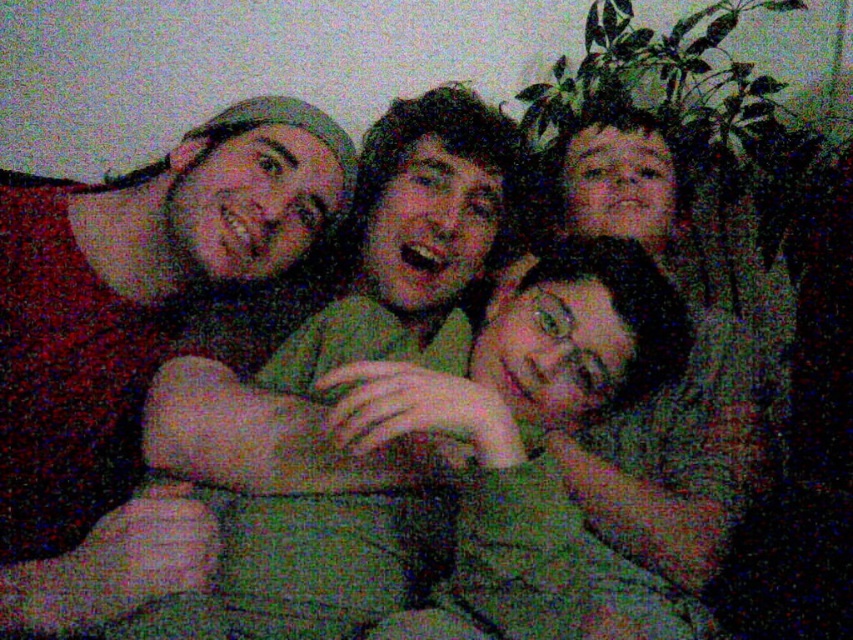
Question: Can you confirm if matte red shirt at left is positioned to the right of green fabric pillow at center?

Choices:
 (A) yes
 (B) no

Answer: (B)

Question: Which point is farther to the camera?

Choices:
 (A) (100, 257)
 (B) (526, 340)

Answer: (A)

Question: Can you confirm if matte red shirt at left is wider than green fabric pillow at center?

Choices:
 (A) no
 (B) yes

Answer: (A)

Question: Does matte red shirt at left have a greater width compared to green fabric pillow at center?

Choices:
 (A) yes
 (B) no

Answer: (B)